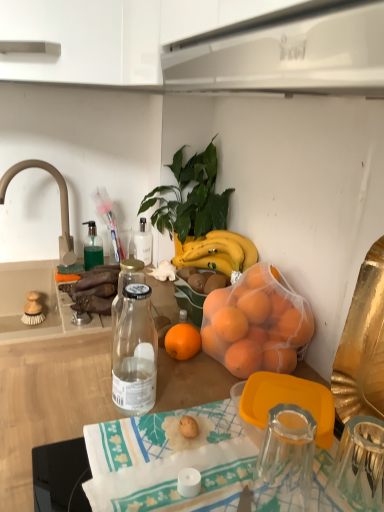
Question: From the image's perspective, is beige matte faucet at upper left below orange mesh bag at center?

Choices:
 (A) no
 (B) yes

Answer: (A)

Question: Is beige matte faucet at upper left positioned beyond the bounds of orange mesh bag at center?

Choices:
 (A) no
 (B) yes

Answer: (B)

Question: Considering the relative positions of beige matte faucet at upper left and orange mesh bag at center in the image provided, is beige matte faucet at upper left to the left of orange mesh bag at center from the viewer's perspective?

Choices:
 (A) no
 (B) yes

Answer: (B)

Question: Is beige matte faucet at upper left thinner than orange mesh bag at center?

Choices:
 (A) no
 (B) yes

Answer: (B)

Question: Is beige matte faucet at upper left taller than orange mesh bag at center?

Choices:
 (A) yes
 (B) no

Answer: (A)

Question: Would you say transparent glass coffee cup at center is inside or outside printed fabric tablecloth at center?

Choices:
 (A) outside
 (B) inside

Answer: (A)

Question: In the image, is transparent glass coffee cup at center positioned in front of or behind printed fabric tablecloth at center?

Choices:
 (A) behind
 (B) front

Answer: (A)

Question: Based on their positions, is transparent glass coffee cup at center located to the left or right of printed fabric tablecloth at center?

Choices:
 (A) left
 (B) right

Answer: (B)

Question: Is transparent glass coffee cup at center wider or thinner than printed fabric tablecloth at center?

Choices:
 (A) thin
 (B) wide

Answer: (A)

Question: Does point (66, 190) appear closer or farther from the camera than point (87, 226)?

Choices:
 (A) closer
 (B) farther

Answer: (A)

Question: Do you think beige matte faucet at upper left is within translucent glass soap dispenser at upper left, or outside of it?

Choices:
 (A) inside
 (B) outside

Answer: (B)

Question: In the image, is beige matte faucet at upper left positioned in front of or behind translucent glass soap dispenser at upper left?

Choices:
 (A) front
 (B) behind

Answer: (A)

Question: In terms of width, does beige matte faucet at upper left look wider or thinner when compared to translucent glass soap dispenser at upper left?

Choices:
 (A) wide
 (B) thin

Answer: (A)

Question: Is point (251, 451) positioned closer to the camera than point (317, 73)?

Choices:
 (A) farther
 (B) closer

Answer: (A)

Question: In the image, is printed fabric tablecloth at center positioned in front of or behind white glossy range hood at upper center?

Choices:
 (A) front
 (B) behind

Answer: (B)